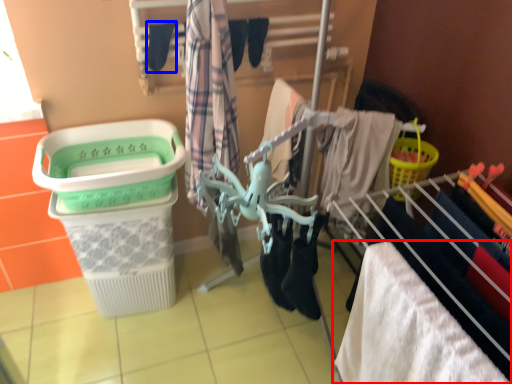
Question: Which object appears farthest to the camera in this image, towel (highlighted by a red box) or clothing (highlighted by a blue box)?

Choices:
 (A) towel
 (B) clothing

Answer: (B)